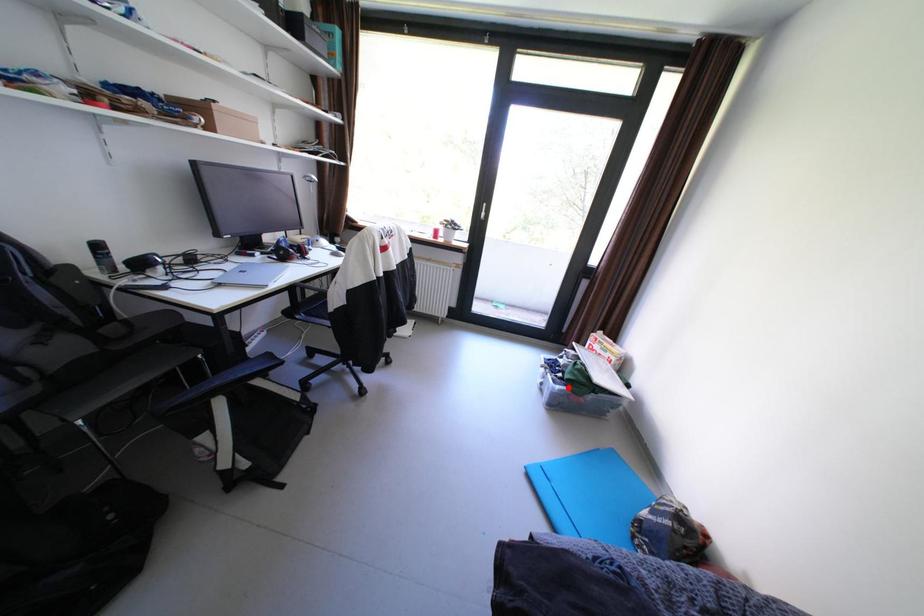
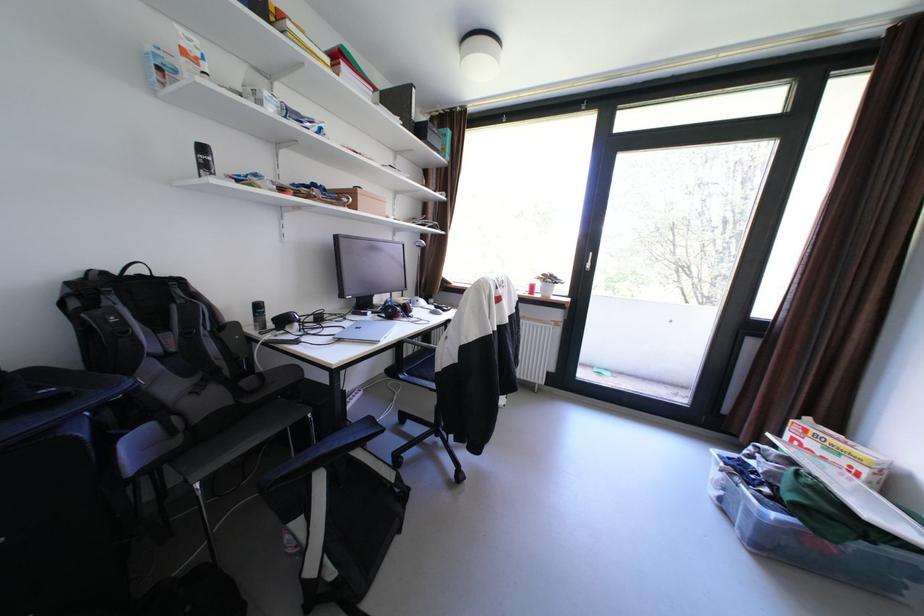
Question: I am providing you with two images of the same scene from different viewpoints. Image1 has a red point marked. In image2, the corresponding 3D location appears at what relative position? Reply with the corresponding letter.

Choices:
 (A) Closer
 (B) Farther

Answer: (A)